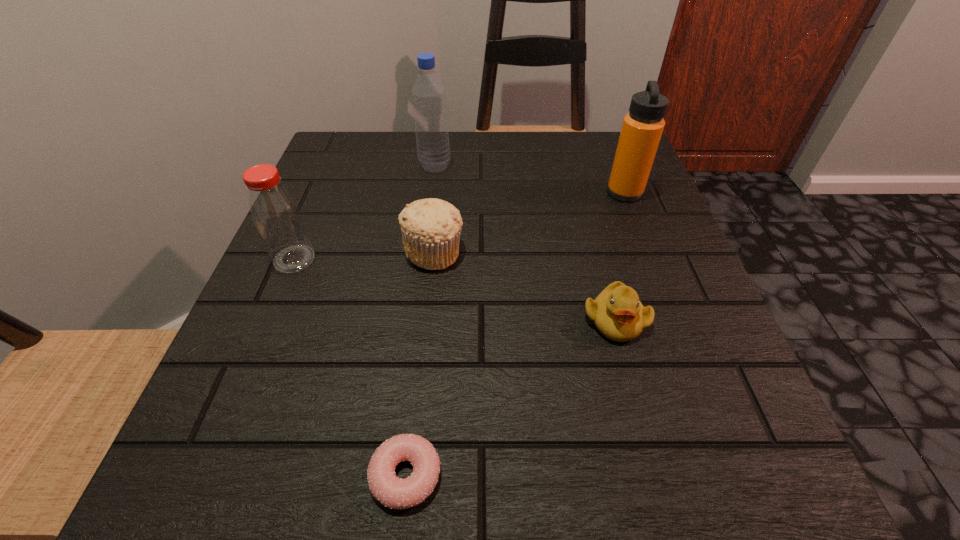
Locate an element on the screen. This screenshot has width=960, height=540. blank region between the doughnut and the rightmost object is located at coordinates (516, 334).

Where is `vacant area between the shortest object and the rightmost object`? Image resolution: width=960 pixels, height=540 pixels. vacant area between the shortest object and the rightmost object is located at coordinates coord(516,334).

Identify which object is the fourth closest to the fourth tallest object. Please provide its 2D coordinates. Your answer should be formatted as a tuple, i.e. [(x, y)], where the tuple contains the x and y coordinates of a point satisfying the conditions above.

[(391, 491)]

Locate which object ranks third in proximity to the fifth object from left to right. Please provide its 2D coordinates. Your answer should be formatted as a tuple, i.e. [(x, y)], where the tuple contains the x and y coordinates of a point satisfying the conditions above.

[(642, 128)]